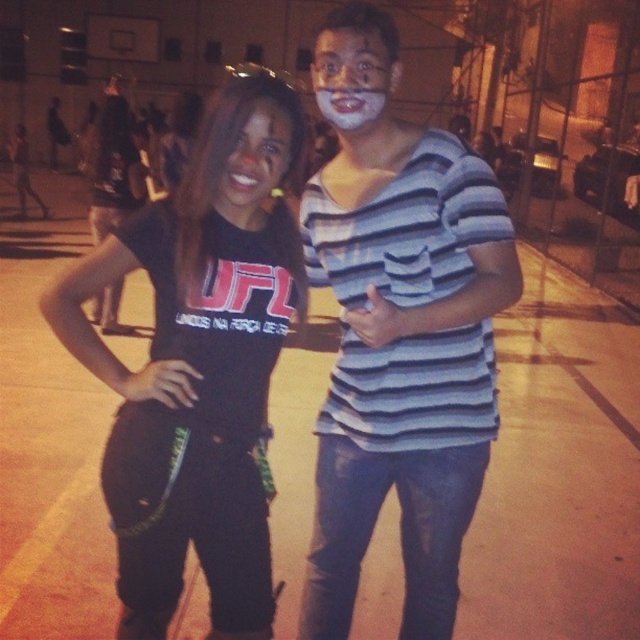
Question: Among these points, which one is farthest from the camera?

Choices:
 (A) (282, 145)
 (B) (170, 214)
 (C) (396, 412)
 (D) (374, 92)

Answer: (C)

Question: Does black fabric pants at center come in front of matte black hair at center?

Choices:
 (A) yes
 (B) no

Answer: (A)

Question: Among these objects, which one is farthest from the camera?

Choices:
 (A) black fabric pants at center
 (B) white matte face at center
 (C) striped cotton shirt at center
 (D) matte black hair at center

Answer: (B)

Question: Does black fabric pants at center appear under white matte face at center?

Choices:
 (A) no
 (B) yes

Answer: (B)

Question: In this image, where is black fabric pants at center located relative to white matte face at center?

Choices:
 (A) right
 (B) left

Answer: (B)

Question: Which of the following is the closest to the observer?

Choices:
 (A) matte black hair at center
 (B) white matte face at center
 (C) striped cotton shirt at center
 (D) black fabric pants at center

Answer: (C)